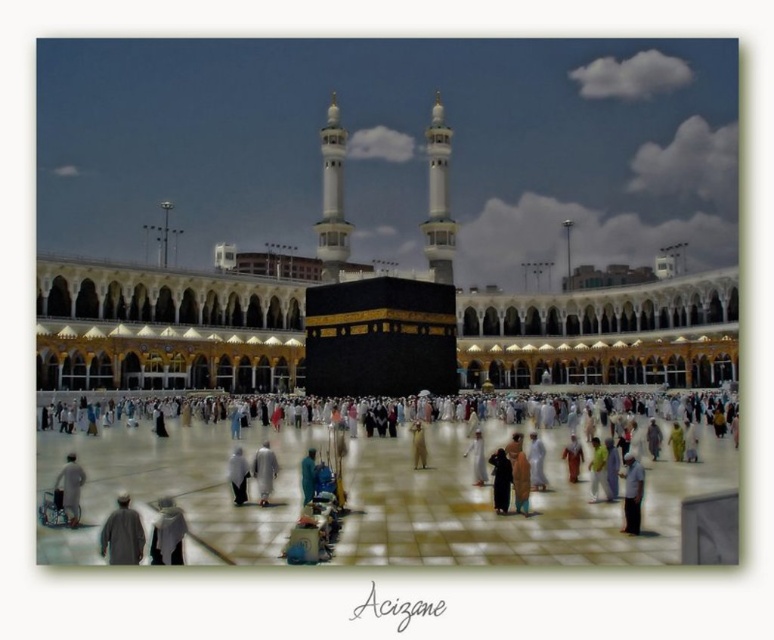
Question: Which of the following is the farthest from the observer?

Choices:
 (A) light gray fabric at lower left
 (B) black matte person at center
 (C) blue fabric person at center

Answer: (B)

Question: Does white fabric at lower left appear under light gray fabric at lower left?

Choices:
 (A) no
 (B) yes

Answer: (B)

Question: Is dark gray fabric person at lower left further to camera compared to light gray fabric at center?

Choices:
 (A) no
 (B) yes

Answer: (A)

Question: Is dark gray fabric person at lower left thinner than black matte person at center?

Choices:
 (A) yes
 (B) no

Answer: (B)

Question: Which point is closer to the camera taking this photo?

Choices:
 (A) (104, 554)
 (B) (173, 556)
 (C) (245, 484)
 (D) (303, 496)

Answer: (A)

Question: Considering the real-world distances, which object is closest to the white fabric person at center?

Choices:
 (A) white fabric at lower left
 (B) light gray fabric at lower left
 (C) light gray fabric at center

Answer: (C)